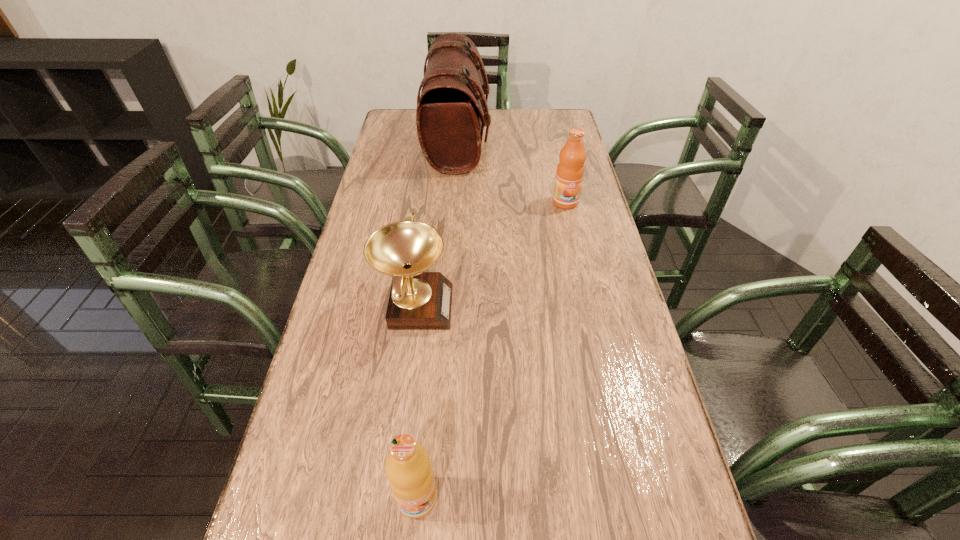
Locate an element on the screen. the farthest object is located at coordinates (450, 122).

You are a GUI agent. You are given a task and a screenshot of the screen. Output one action in this format:
    pyautogui.click(x=<x>, y=<y>)
    Task: Click on the tallest object
    The width and height of the screenshot is (960, 540).
    Given the screenshot: What is the action you would take?
    pyautogui.click(x=450, y=122)

The height and width of the screenshot is (540, 960). Find the location of `the third nearest object`. the third nearest object is located at coordinates (569, 175).

The width and height of the screenshot is (960, 540). In order to click on the farther fruit juice in this screenshot , I will do `click(569, 175)`.

Find the location of a particular element. the nearer fruit juice is located at coordinates (408, 468).

The image size is (960, 540). What are the coordinates of `the nearest object` in the screenshot? It's located at (408, 468).

I want to click on award, so click(x=419, y=300).

Find the location of a particular element. free location located on the front-facing side of the satchel is located at coordinates (534, 142).

Identify the location of vacant space located 0.080m on the label side of the second farthest object. point(570,226).

Find the location of a particular element. vacant space situated 0.160m on the front-facing side of the award is located at coordinates (515, 305).